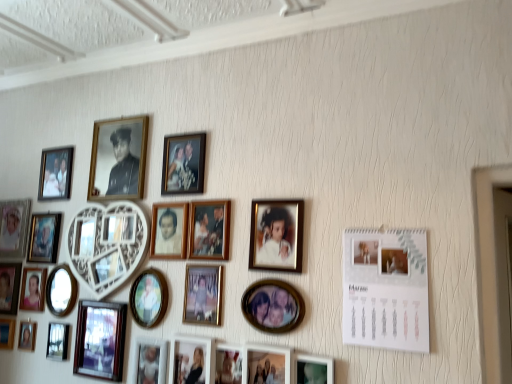
Question: Considering their positions, is matte black photo frame at lower right, which appears as the 2th picture frame when viewed from the right, located in front of or behind matte black picture frame at lower left, arranged as the 16th picture frame when viewed from the right?

Choices:
 (A) behind
 (B) front

Answer: (B)

Question: In terms of height, does matte black photo frame at lower right, which appears as the 2th picture frame when viewed from the right, look taller or shorter compared to matte black picture frame at lower left, which is the 10th picture frame from left to right?

Choices:
 (A) tall
 (B) short

Answer: (B)

Question: Which is nearer to the metallic silver photo frame at lower left, the ninth picture frame positioned from the left?

Choices:
 (A) matte black picture frame at lower left, arranged as the 16th picture frame when viewed from the right
 (B) white paper calendar at upper right, which is the 25th picture frame from left to right
 (C) matte black picture frame at center, the 17th picture frame from the left
 (D) matte black portrait at left, the 20th picture frame viewed from the right
 (E) matte wooden photo frame at lower center, which is counted as the twentieth picture frame, starting from the left

Answer: (A)

Question: Considering the real-world distances, which object is farthest from the gold metallic photo frame at center, placed as the 4th picture frame when sorted from right to left?

Choices:
 (A) matte black picture frame at upper left, which appears as the nineteenth picture frame when viewed from the right
 (B) matte black photo frame at lower left, marked as the 22th picture frame in a right-to-left arrangement
 (C) matte wooden photo frame at center, the eleventh picture frame positioned from the right
 (D) matte black photo frame at lower right, which appears as the 2th picture frame when viewed from the right
 (E) wooden photo frame at lower left, the 25th picture frame in the right-to-left sequence

Answer: (E)